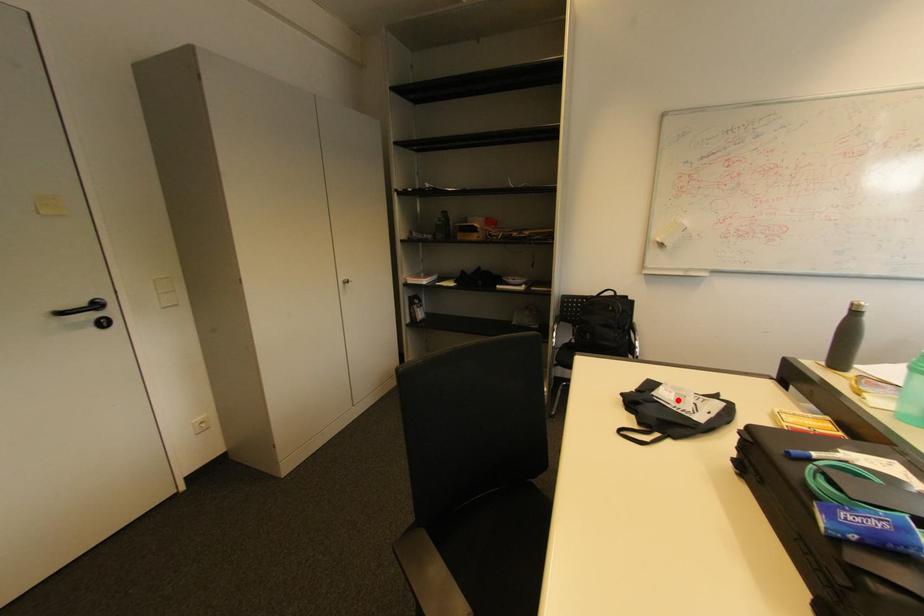
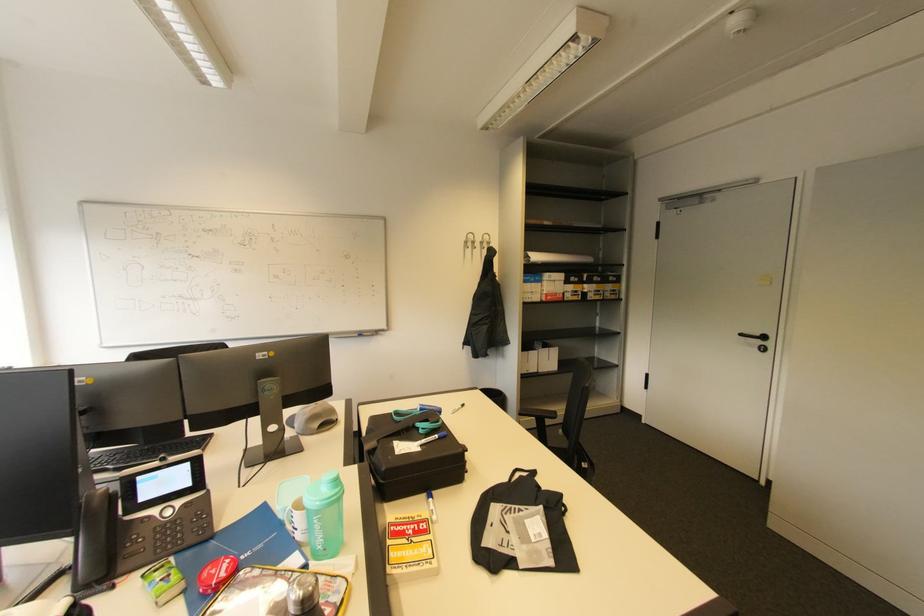
Find the pixel in the second image that matches the highlighted location in the first image.

(531, 523)